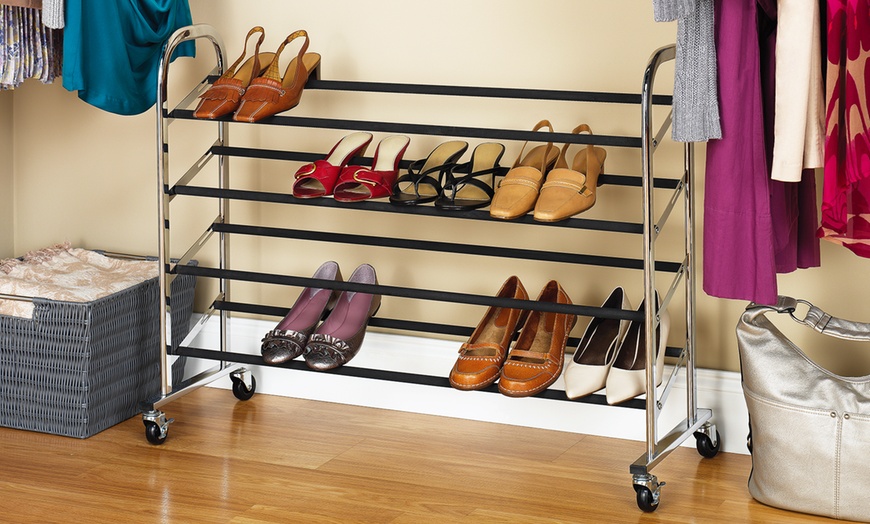
This screenshot has height=524, width=870. I want to click on shoes on middle rack, so click(317, 181), click(360, 182), click(416, 190), click(465, 192), click(513, 192), click(560, 199).